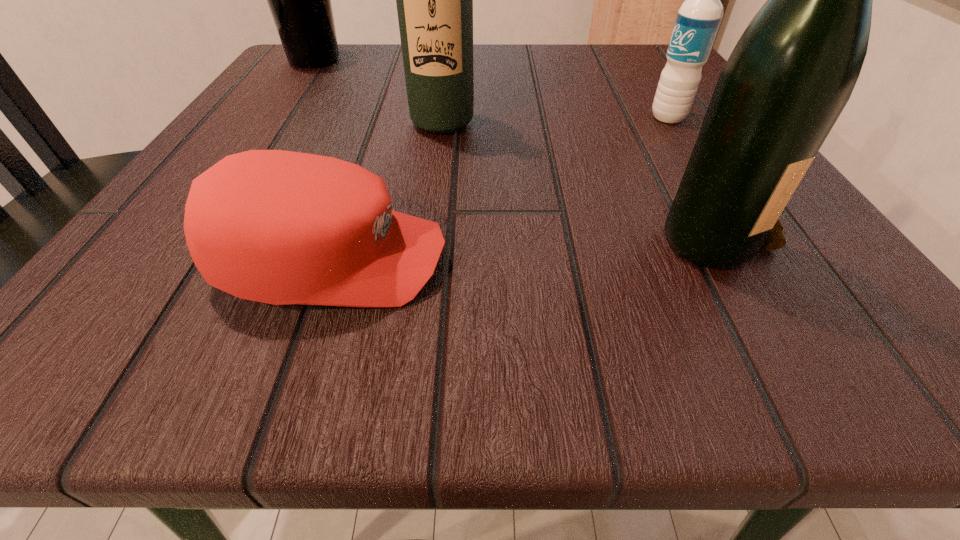
Locate which wine bottle is the closest to the water bottle. Please provide its 2D coordinates. Your answer should be formatted as a tuple, i.e. [(x, y)], where the tuple contains the x and y coordinates of a point satisfying the conditions above.

[(793, 70)]

Identify the location of free space that satisfies the following two spatial constraints: 1. on the front side of the rightmost wine bottle; 2. on the front-facing side of the cap. The height and width of the screenshot is (540, 960). (730, 261).

This screenshot has width=960, height=540. Find the location of `free spot that satisfies the following two spatial constraints: 1. on the label of the farthest wine bottle; 2. on the back side of the rightmost wine bottle`. free spot that satisfies the following two spatial constraints: 1. on the label of the farthest wine bottle; 2. on the back side of the rightmost wine bottle is located at coordinates (196, 231).

Find the location of `free location that satisfies the following two spatial constraints: 1. on the front side of the rightmost wine bottle; 2. on the front-facing side of the cap`. free location that satisfies the following two spatial constraints: 1. on the front side of the rightmost wine bottle; 2. on the front-facing side of the cap is located at coordinates (730, 261).

Where is `vacant space that satisfies the following two spatial constraints: 1. on the label of the second shortest object; 2. on the front side of the nearest wine bottle`? vacant space that satisfies the following two spatial constraints: 1. on the label of the second shortest object; 2. on the front side of the nearest wine bottle is located at coordinates (740, 231).